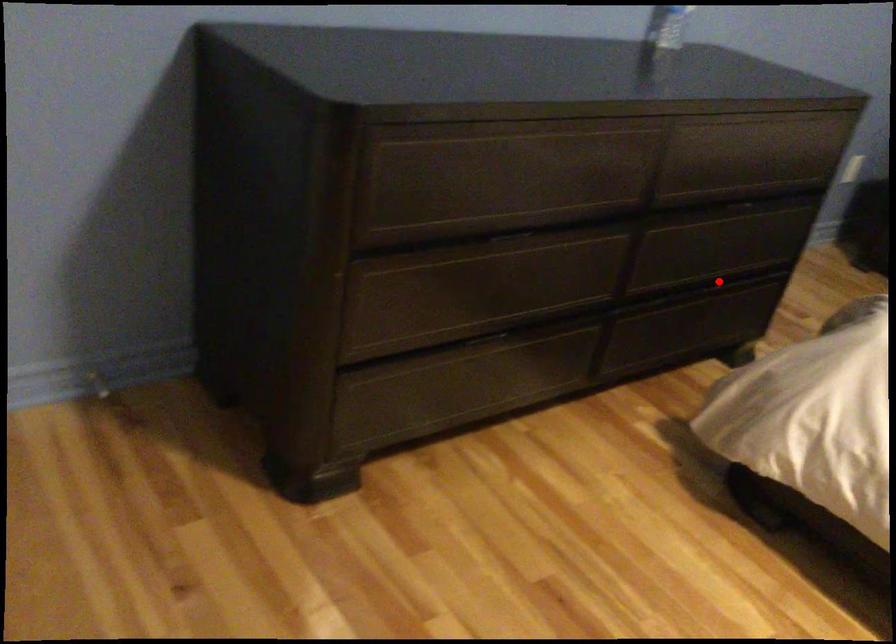
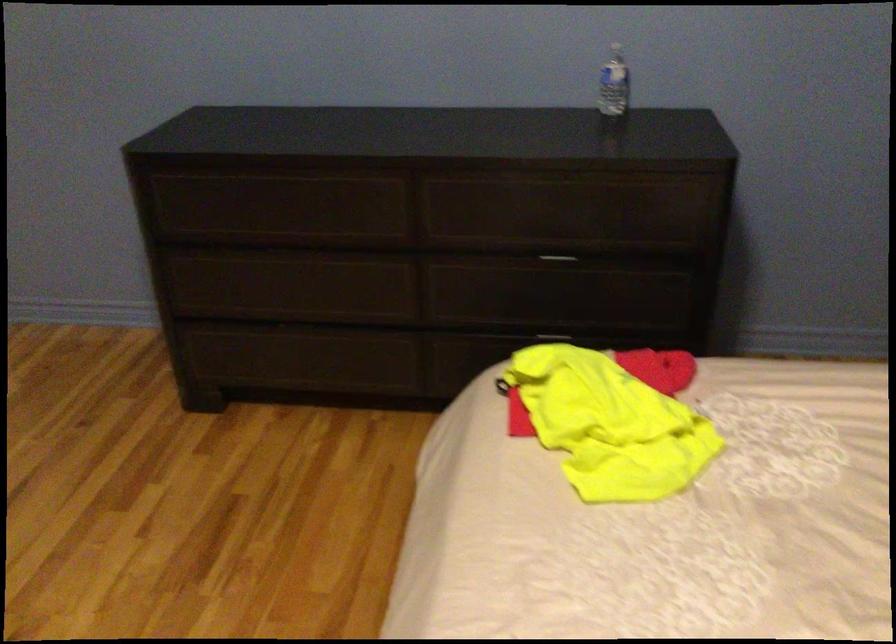
Find the pixel in the second image that matches the highlighted location in the first image.

(553, 333)